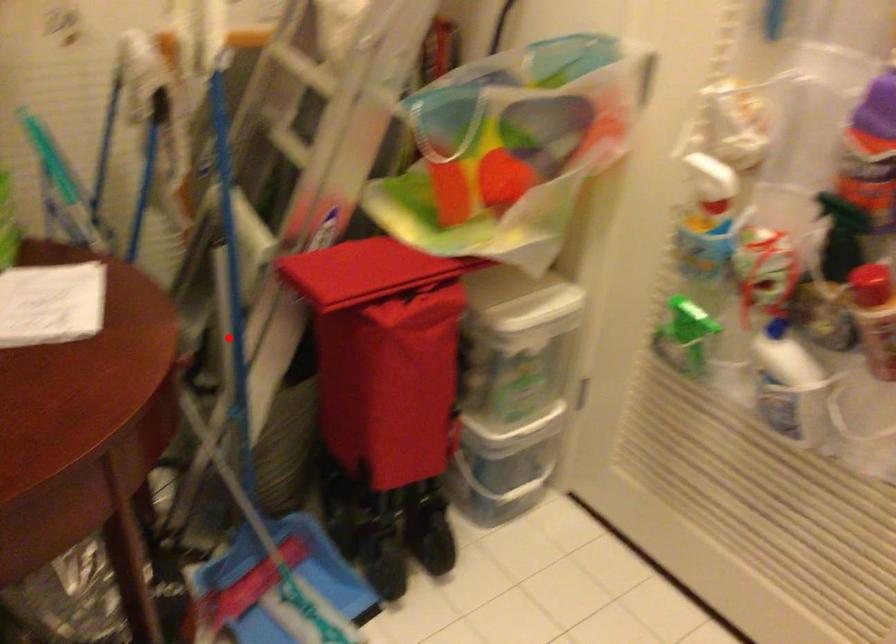
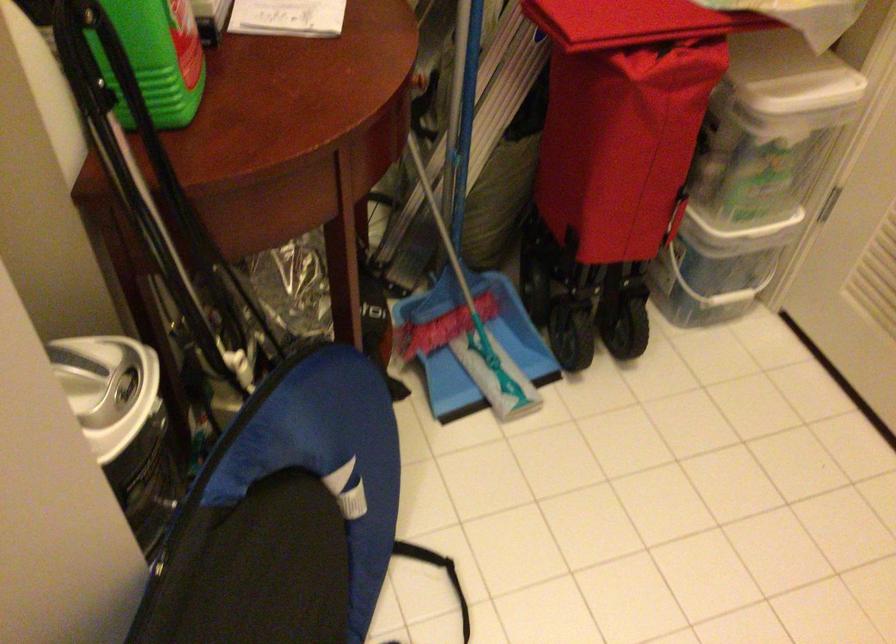
Locate, in the second image, the point that corresponds to the highlighted location in the first image.

(460, 71)